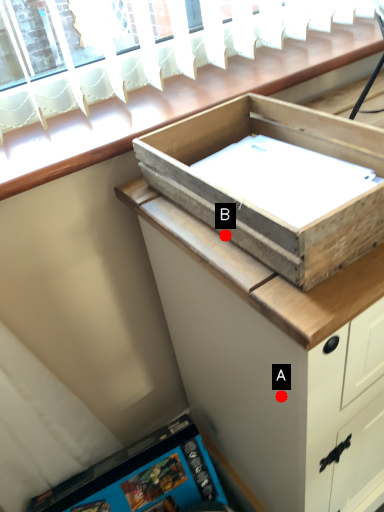
Question: Two points are circled on the image, labeled by A and B beside each circle. Among these points, which one is nearest to the camera?

Choices:
 (A) A is closer
 (B) B is closer

Answer: (B)